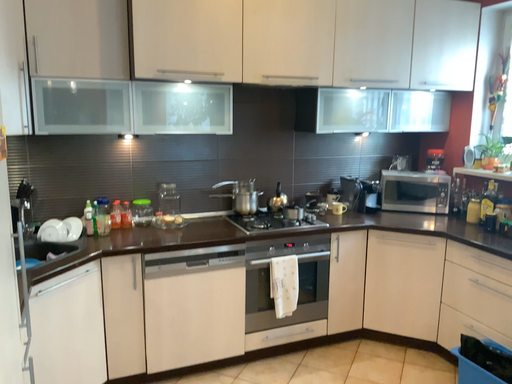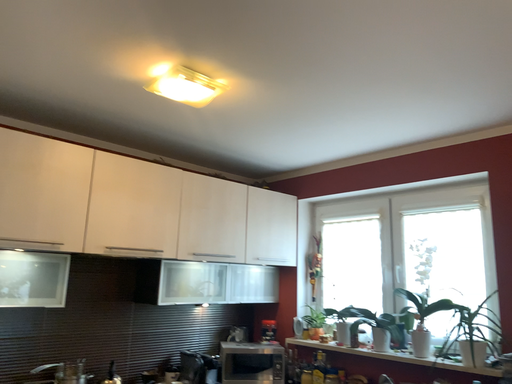
Question: How did the camera likely rotate when shooting the video?

Choices:
 (A) rotated left
 (B) rotated right

Answer: (B)